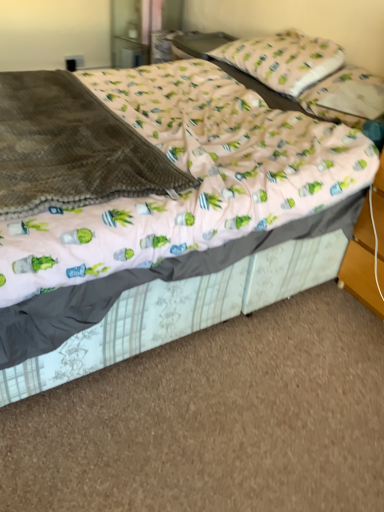
Question: Can we say pink fabric pillow at upper right, the 1th pillow positioned from the bottom, lies outside pink fabric bed at center?

Choices:
 (A) no
 (B) yes

Answer: (A)

Question: From the image's perspective, does pink fabric pillow at upper right, the 2th pillow when ordered from top to bottom, appear higher than pink fabric bed at center?

Choices:
 (A) yes
 (B) no

Answer: (A)

Question: Is pink fabric pillow at upper right, the 1th pillow positioned from the bottom, directly adjacent to pink fabric bed at center?

Choices:
 (A) no
 (B) yes

Answer: (A)

Question: Does pink fabric pillow at upper right, the 2th pillow when ordered from top to bottom, turn towards pink fabric bed at center?

Choices:
 (A) yes
 (B) no

Answer: (A)

Question: Does pink fabric pillow at upper right, the 1th pillow positioned from the bottom, come behind pink fabric bed at center?

Choices:
 (A) no
 (B) yes

Answer: (B)

Question: Can you confirm if pink fabric pillow at upper right, the 2th pillow when ordered from top to bottom, is thinner than pink fabric bed at center?

Choices:
 (A) yes
 (B) no

Answer: (A)

Question: Can you confirm if pink fabric pillow at upper right, the 2th pillow when ordered from top to bottom, is shorter than brown fleece blanket at left?

Choices:
 (A) no
 (B) yes

Answer: (B)

Question: Is pink fabric pillow at upper right, the 1th pillow positioned from the bottom, positioned far away from brown fleece blanket at left?

Choices:
 (A) no
 (B) yes

Answer: (B)

Question: Is pink fabric pillow at upper right, the 2th pillow when ordered from top to bottom, closer to the viewer compared to brown fleece blanket at left?

Choices:
 (A) no
 (B) yes

Answer: (A)

Question: From a real-world perspective, is pink fabric pillow at upper right, the 1th pillow positioned from the bottom, physically above brown fleece blanket at left?

Choices:
 (A) yes
 (B) no

Answer: (A)

Question: Would you say pink fabric pillow at upper right, the 1th pillow positioned from the bottom, is outside brown fleece blanket at left?

Choices:
 (A) no
 (B) yes

Answer: (B)

Question: From a real-world perspective, does pink fabric pillow at upper right, the 2th pillow when ordered from top to bottom, sit lower than brown fleece blanket at left?

Choices:
 (A) yes
 (B) no

Answer: (B)

Question: Does pink fabric bed at center touch pink fabric pillow at upper center, which is counted as the first pillow, starting from the top?

Choices:
 (A) no
 (B) yes

Answer: (A)